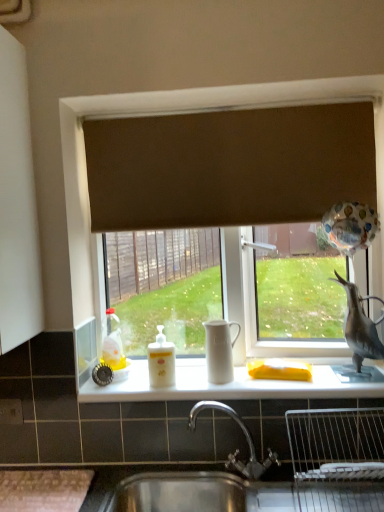
What do you see at coordinates (360, 326) in the screenshot? I see `gray matte bird at right` at bounding box center [360, 326].

Where is `white glossy counter top at center`? The height and width of the screenshot is (512, 384). white glossy counter top at center is located at coordinates (234, 385).

Describe the element at coordinates (229, 166) in the screenshot. I see `brown fabric curtain at upper center` at that location.

This screenshot has width=384, height=512. I want to click on white glossy bottle at center, so click(x=161, y=361).

This screenshot has height=512, width=384. I want to click on gray matte bird at right, so click(360, 326).

Does white glossy counter top at center have a larger size compared to white matte tea pot at center?

Yes.

Is white glossy counter top at center far away from white matte tea pot at center?

No, white glossy counter top at center is not far away from white matte tea pot at center.

Considering the relative positions of white glossy counter top at center and white matte tea pot at center in the image provided, is white glossy counter top at center to the left or to the right of white matte tea pot at center?

Clearly, white glossy counter top at center is on the right of white matte tea pot at center in the image.

Between translucent plastic bottle at left and brown fabric curtain at upper center, which one appears on the right side from the viewer's perspective?

brown fabric curtain at upper center.

What's the angular difference between translucent plastic bottle at left and brown fabric curtain at upper center's facing directions?

They differ by 0.337 degrees in their facing directions.

Does translucent plastic bottle at left have a greater width compared to brown fabric curtain at upper center?

Correct, the width of translucent plastic bottle at left exceeds that of brown fabric curtain at upper center.

From the image's perspective, does white matte tea pot at center appear lower than brown fabric curtain at upper center?

Correct, white matte tea pot at center appears lower than brown fabric curtain at upper center in the image.

Which object is more forward, white matte tea pot at center or brown fabric curtain at upper center?

white matte tea pot at center is more forward.

How many degrees apart are the facing directions of white matte tea pot at center and brown fabric curtain at upper center?

1.84 degrees.

From a real-world perspective, which is physically below, white matte tea pot at center or brown fabric curtain at upper center?

white matte tea pot at center.

Considering the relative sizes of translucent plastic bottle at left and white matte tea pot at center in the image provided, is translucent plastic bottle at left taller than white matte tea pot at center?

Correct, translucent plastic bottle at left is much taller as white matte tea pot at center.

Is translucent plastic bottle at left with white matte tea pot at center?

Answer: No, translucent plastic bottle at left is not touching white matte tea pot at center.

Is translucent plastic bottle at left in front of or behind white matte tea pot at center in the image?

translucent plastic bottle at left is positioned farther from the viewer than white matte tea pot at center.

Who is bigger, white glossy bottle at center or brown fabric curtain at upper center?

With larger size is brown fabric curtain at upper center.

From a real-world perspective, does white glossy bottle at center stand above brown fabric curtain at upper center?

No, from a real-world perspective, white glossy bottle at center is not on top of brown fabric curtain at upper center.

In the image, is white glossy bottle at center positioned in front of or behind brown fabric curtain at upper center?

Visually, white glossy bottle at center is located in front of brown fabric curtain at upper center.

Does gray matte bird at right lie behind white matte tea pot at center?

No, it is not.

Considering the sizes of objects gray matte bird at right and white matte tea pot at center in the image provided, who is wider, gray matte bird at right or white matte tea pot at center?

With larger width is gray matte bird at right.

Considering the positions of objects gray matte bird at right and white matte tea pot at center in the image provided, who is more to the right, gray matte bird at right or white matte tea pot at center?

From the viewer's perspective, gray matte bird at right appears more on the right side.

In the scene shown: From a real-world perspective, is gray matte bird at right physically located above or below white matte tea pot at center?

Clearly, from a real-world perspective, gray matte bird at right is above white matte tea pot at center.

Consider the image. From the image's perspective, is white matte tea pot at center over white glossy bottle at center?

Yes, from the image's perspective, white matte tea pot at center is on top of white glossy bottle at center.

Is white matte tea pot at center facing away from white glossy bottle at center?

No.

Locate an element on the screen. The image size is (384, 512). bottle behind the white matte tea pot at center is located at coordinates (161, 361).

Where is `counter top to the right of white matte tea pot at center`? The width and height of the screenshot is (384, 512). counter top to the right of white matte tea pot at center is located at coordinates (234, 385).

Identify the location of curtain in front of the translucent plastic bottle at left. (229, 166).

Based on the photo, which object lies further to the anchor point white matte tea pot at center, gray matte bird at right or white glossy counter top at center?

Based on the image, gray matte bird at right appears to be further to white matte tea pot at center.

In the scene shown: Considering their positions, is gray matte bird at right positioned closer to brown fabric curtain at upper center than translucent plastic bottle at left?

gray matte bird at right is closer to brown fabric curtain at upper center.

Based on the photo, from the image, which object appears to be nearer to white matte tea pot at center, translucent plastic bottle at left or white glossy counter top at center?

white glossy counter top at center lies closer to white matte tea pot at center than the other object.

Estimate the real-world distances between objects in this image. Which object is closer to white glossy counter top at center, gray matte bird at right or brown fabric curtain at upper center?

The object closer to white glossy counter top at center is gray matte bird at right.

Looking at the image, which one is located closer to white matte tea pot at center, translucent plastic bottle at left or gray matte bird at right?

translucent plastic bottle at left is closer to white matte tea pot at center.

From the image, which object appears to be nearer to translucent plastic bottle at left, white glossy bottle at center or gray matte bird at right?

white glossy bottle at center.

When comparing their distances from white glossy counter top at center, does brown fabric curtain at upper center or gray matte bird at right seem closer?

Among the two, gray matte bird at right is located nearer to white glossy counter top at center.

From the image, which object appears to be nearer to brown fabric curtain at upper center, gray matte bird at right or white matte tea pot at center?

The object closer to brown fabric curtain at upper center is gray matte bird at right.

Locate an element on the screen. This screenshot has width=384, height=512. bottle between translucent plastic bottle at left and gray matte bird at right from left to right is located at coordinates (161, 361).

I want to click on bottle between translucent plastic bottle at left and white glossy counter top at center in the horizontal direction, so click(161, 361).

Identify the location of bottle between brown fabric curtain at upper center and white glossy counter top at center from top to bottom. The image size is (384, 512). (161, 361).

Where is `bottle between translucent plastic bottle at left and white matte tea pot at center`? This screenshot has width=384, height=512. bottle between translucent plastic bottle at left and white matte tea pot at center is located at coordinates (161, 361).